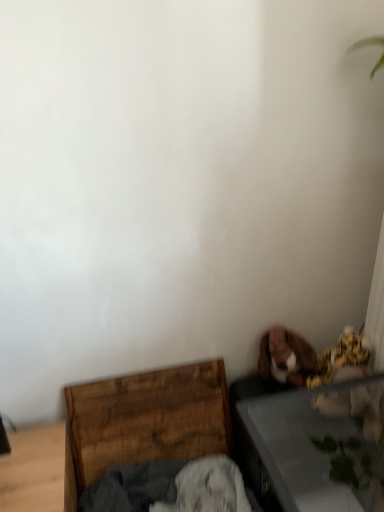
Where is `dark gray cotton cloth at lower center`? This screenshot has width=384, height=512. dark gray cotton cloth at lower center is located at coordinates (169, 488).

You are a GUI agent. You are given a task and a screenshot of the screen. Output one action in this format:
    pyautogui.click(x=<x>, y=<y>)
    Task: Click on the wooden chest at lower left
    This screenshot has height=512, width=384.
    Given the screenshot: What is the action you would take?
    pyautogui.click(x=144, y=421)

What do you see at coordinates (144, 421) in the screenshot? The width and height of the screenshot is (384, 512). I see `wooden chest at lower left` at bounding box center [144, 421].

At what (x,y) coordinates should I click in order to perform the action: click on dark gray cotton cloth at lower center. Please return your answer as a coordinate pair (x, y). This screenshot has height=512, width=384. Looking at the image, I should click on (169, 488).

Who is taller, dark gray cotton cloth at lower center or transparent glass table at lower right?

With more height is transparent glass table at lower right.

From the image's perspective, does dark gray cotton cloth at lower center appear higher than transparent glass table at lower right?

No, from the image's perspective, dark gray cotton cloth at lower center is not on top of transparent glass table at lower right.

Identify the location of clothing behind the transparent glass table at lower right. (169, 488).

From the image's perspective, which is below, brown plush dog at lower right or wooden chest at lower left?

From the image's view, wooden chest at lower left is below.

Is brown plush dog at lower right completely or partially outside of wooden chest at lower left?

Indeed, brown plush dog at lower right is completely outside wooden chest at lower left.

Is brown plush dog at lower right facing towards wooden chest at lower left?

No, brown plush dog at lower right is not oriented towards wooden chest at lower left.

Is the position of brown plush dog at lower right more distant than that of wooden chest at lower left?

Yes, brown plush dog at lower right is behind wooden chest at lower left.

Is transparent glass table at lower right next to wooden chest at lower left?

No, transparent glass table at lower right is not touching wooden chest at lower left.

From a real-world perspective, relative to wooden chest at lower left, is transparent glass table at lower right vertically above or below?

Clearly, from a real-world perspective, transparent glass table at lower right is above wooden chest at lower left.

Is transparent glass table at lower right situated inside wooden chest at lower left or outside?

transparent glass table at lower right is located beyond the bounds of wooden chest at lower left.

Which of these two, dark gray cotton cloth at lower center or brown plush dog at lower right, is wider?

With larger width is dark gray cotton cloth at lower center.

Considering the sizes of dark gray cotton cloth at lower center and brown plush dog at lower right in the image, is dark gray cotton cloth at lower center taller or shorter than brown plush dog at lower right?

Clearly, dark gray cotton cloth at lower center is shorter compared to brown plush dog at lower right.

Does dark gray cotton cloth at lower center appear on the right side of brown plush dog at lower right?

In fact, dark gray cotton cloth at lower center is to the left of brown plush dog at lower right.

Which is behind, point (157, 511) or point (292, 367)?

The point (292, 367) is more distant.

Considering the relative sizes of brown plush dog at lower right and transparent glass table at lower right in the image provided, is brown plush dog at lower right thinner than transparent glass table at lower right?

Correct, the width of brown plush dog at lower right is less than that of transparent glass table at lower right.

Are brown plush dog at lower right and transparent glass table at lower right beside each other?

No, brown plush dog at lower right is not touching transparent glass table at lower right.

Could you tell me if brown plush dog at lower right is facing transparent glass table at lower right?

Yes, brown plush dog at lower right is oriented towards transparent glass table at lower right.

Does point (262, 358) come in front of point (372, 459)?

No.

Is transparent glass table at lower right facing away from brown plush dog at lower right?

transparent glass table at lower right does not have its back to brown plush dog at lower right.

From the image's perspective, who appears lower, transparent glass table at lower right or brown plush dog at lower right?

transparent glass table at lower right appears lower in the image.

From a real-world perspective, relative to brown plush dog at lower right, is transparent glass table at lower right vertically above or below?

Clearly, from a real-world perspective, transparent glass table at lower right is below brown plush dog at lower right.

Which object is thinner, transparent glass table at lower right or brown plush dog at lower right?

With smaller width is brown plush dog at lower right.

Choose the correct answer: Is wooden chest at lower left inside brown plush dog at lower right or outside it?

wooden chest at lower left is not inside brown plush dog at lower right, it's outside.

From the image's perspective, which is below, wooden chest at lower left or brown plush dog at lower right?

wooden chest at lower left.

Is wooden chest at lower left in contact with brown plush dog at lower right?

wooden chest at lower left and brown plush dog at lower right are clearly separated.

Can you confirm if wooden chest at lower left is shorter than brown plush dog at lower right?

No.

You are a GUI agent. You are given a task and a screenshot of the screen. Output one action in this format:
    pyautogui.click(x=<x>, y=<y>)
    Task: Click on the table located in front of the dark gray cotton cloth at lower center
    Image resolution: width=384 pixels, height=512 pixels.
    Given the screenshot: What is the action you would take?
    pyautogui.click(x=320, y=445)

At what (x,y) coordinates should I click in order to perform the action: click on furniture on the left of brown plush dog at lower right. Please return your answer as a coordinate pair (x, y). Looking at the image, I should click on (144, 421).

Which object lies further to the anchor point transparent glass table at lower right, brown plush dog at lower right or wooden chest at lower left?

The object further to transparent glass table at lower right is wooden chest at lower left.

Based on their spatial positions, is transparent glass table at lower right or wooden chest at lower left closer to brown plush dog at lower right?

transparent glass table at lower right lies closer to brown plush dog at lower right than the other object.

Based on their spatial positions, is brown plush dog at lower right or dark gray cotton cloth at lower center further from transparent glass table at lower right?

dark gray cotton cloth at lower center lies further to transparent glass table at lower right than the other object.

When comparing their distances from dark gray cotton cloth at lower center, does transparent glass table at lower right or wooden chest at lower left seem closer?

Based on the image, wooden chest at lower left appears to be nearer to dark gray cotton cloth at lower center.

From the image, which object appears to be farther from wooden chest at lower left, transparent glass table at lower right or dark gray cotton cloth at lower center?

transparent glass table at lower right lies further to wooden chest at lower left than the other object.

From the image, which object appears to be farther from wooden chest at lower left, dark gray cotton cloth at lower center or brown plush dog at lower right?

Based on the image, brown plush dog at lower right appears to be further to wooden chest at lower left.

Estimate the real-world distances between objects in this image. Which object is further from dark gray cotton cloth at lower center, wooden chest at lower left or transparent glass table at lower right?

transparent glass table at lower right is positioned further to the anchor dark gray cotton cloth at lower center.

Looking at this image, which object lies further to the anchor point brown plush dog at lower right, dark gray cotton cloth at lower center or transparent glass table at lower right?

Based on the image, dark gray cotton cloth at lower center appears to be further to brown plush dog at lower right.

This screenshot has height=512, width=384. Find the location of `clothing located between wooden chest at lower left and brown plush dog at lower right in the left-right direction`. clothing located between wooden chest at lower left and brown plush dog at lower right in the left-right direction is located at coordinates (169, 488).

At what (x,y) coordinates should I click in order to perform the action: click on clothing located between transparent glass table at lower right and brown plush dog at lower right in the depth direction. Please return your answer as a coordinate pair (x, y). The width and height of the screenshot is (384, 512). Looking at the image, I should click on (169, 488).

Where is `clothing between transparent glass table at lower right and wooden chest at lower left in the front-back direction`? clothing between transparent glass table at lower right and wooden chest at lower left in the front-back direction is located at coordinates (169, 488).

The width and height of the screenshot is (384, 512). I want to click on furniture between transparent glass table at lower right and brown plush dog at lower right in the front-back direction, so click(144, 421).